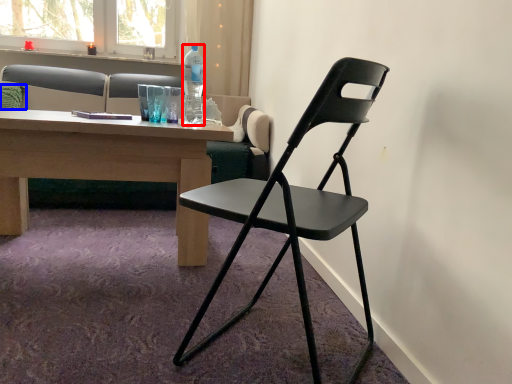
Question: Which object appears closest to the camera in this image, bottle (highlighted by a red box) or pillow (highlighted by a blue box)?

Choices:
 (A) bottle
 (B) pillow

Answer: (A)